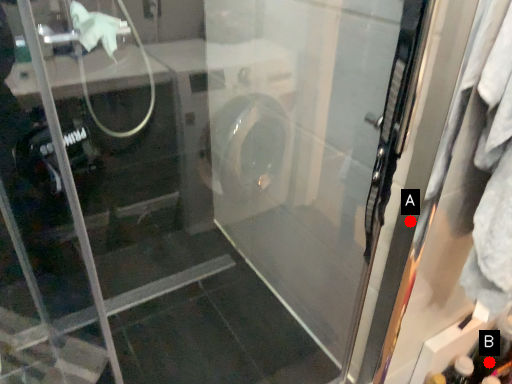
Question: Two points are circled on the image, labeled by A and B beside each circle. Among these points, which one is farthest from the camera?

Choices:
 (A) A is further
 (B) B is further

Answer: (B)